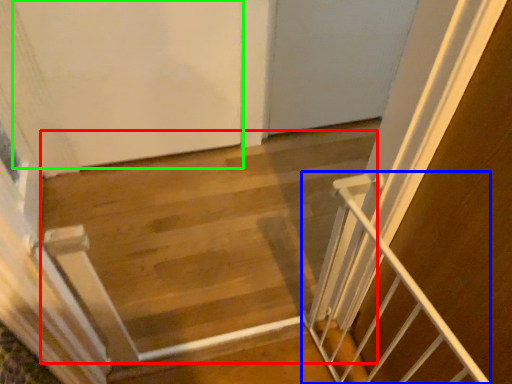
Question: Based on their relative distances, which object is farther from stairwell (highlighted by a red box)? Choose from stairs (highlighted by a blue box) and door (highlighted by a green box).

Choices:
 (A) stairs
 (B) door

Answer: (A)